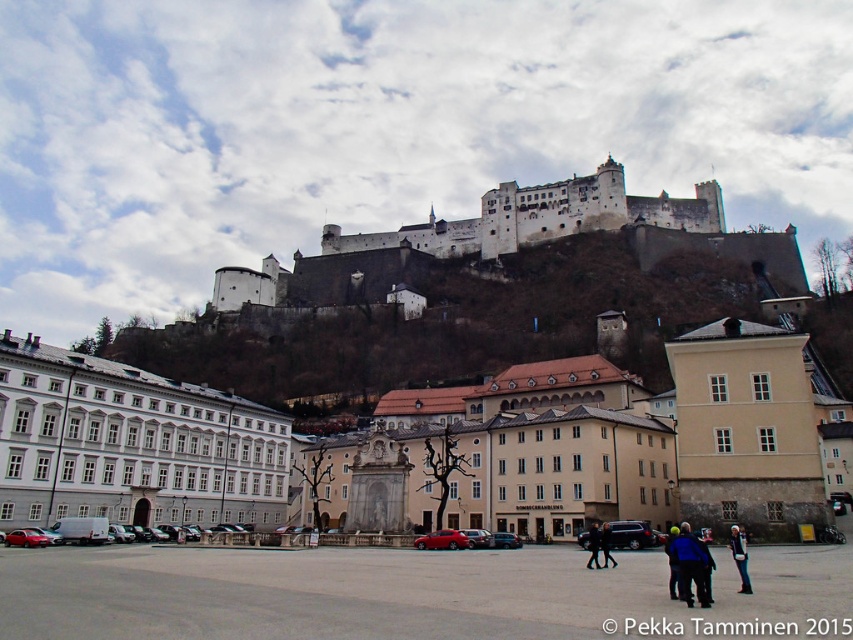
Based on the photo, you are an architect designing a new town square. You want to place a statue of the same size as the black leather jacket at lower center in the square. Based on the scene, how many statues of that size could fit side by side along the width of the white stone castle at upper center?

The white stone castle at upper center is wider than the black leather jacket at lower center. Since the castle is wider, you could fit multiple statues of the jacket size side by side along its width.

You are a photographer in the town square and want to capture both the dark blue jacket at center and the blue fabric jacket at lower right in the same frame. Which jacket should you focus on first to ensure both are in the shot?

The dark blue jacket at center has a lesser height compared to the blue fabric jacket at lower right, so you should focus on the blue fabric jacket at lower right first since it is taller and will require more space in the frame.